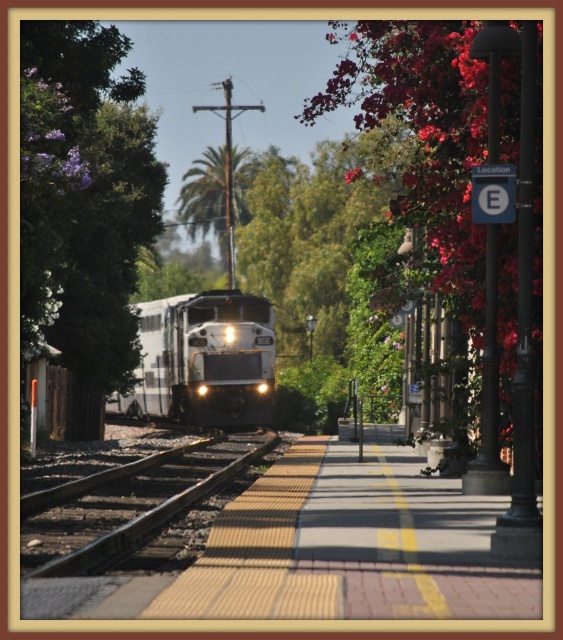
You are a photographer standing on the platform and want to capture both the white glossy passenger train at center and the green leafy palm at center in a single photo. Which object should you frame first in your camera to ensure both fit in the shot?

The white glossy passenger train at center is thinner than the green leafy palm at center, so you should frame the green leafy palm at center first since it occupies more space and adjusting the camera angle to include both would require accommodating its width.

You are a pedestrian waiting on the platform and see the purple leafy tree at left and the black asphalt train track at center. Which object is closer to you?

The purple leafy tree at left is closer to you because the black asphalt train track at center is behind it.